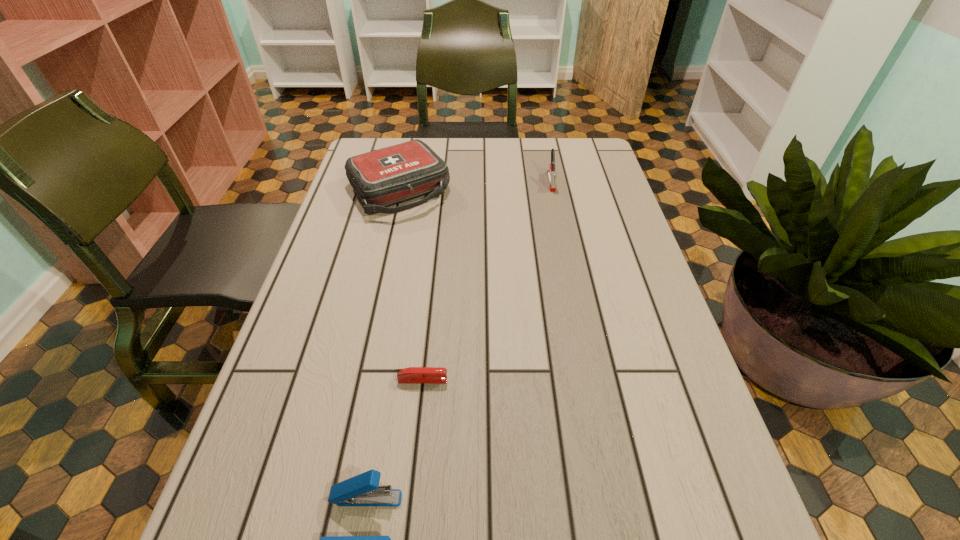
Locate an element on the screen. object positioned at the left edge is located at coordinates (387, 176).

Locate an element on the screen. object situated at the far left corner is located at coordinates (387, 176).

In the image, there is a desktop. Where is `free space at the far edge`? The image size is (960, 540). free space at the far edge is located at coordinates (444, 146).

This screenshot has height=540, width=960. I want to click on vacant space at the left edge of the desktop, so (x=289, y=329).

Locate an element on the screen. vacant space at the right edge is located at coordinates (602, 364).

This screenshot has width=960, height=540. In the image, there is a desktop. Identify the location of free space at the far right corner. (572, 176).

You are a GUI agent. You are given a task and a screenshot of the screen. Output one action in this format:
    pyautogui.click(x=<x>, y=<y>)
    Task: Click on the unoccupied area between the shortest object and the first-aid kit
    
    Given the screenshot: What is the action you would take?
    pyautogui.click(x=411, y=285)

Identify the location of empty location between the first-aid kit and the rightmost stapler. This screenshot has width=960, height=540. (475, 186).

Where is `free space between the rightmost object and the shortest stapler`? This screenshot has width=960, height=540. free space between the rightmost object and the shortest stapler is located at coordinates (487, 281).

Identify the location of vacant point located between the rightmost stapler and the second nearest stapler. The image size is (960, 540). (x=487, y=281).